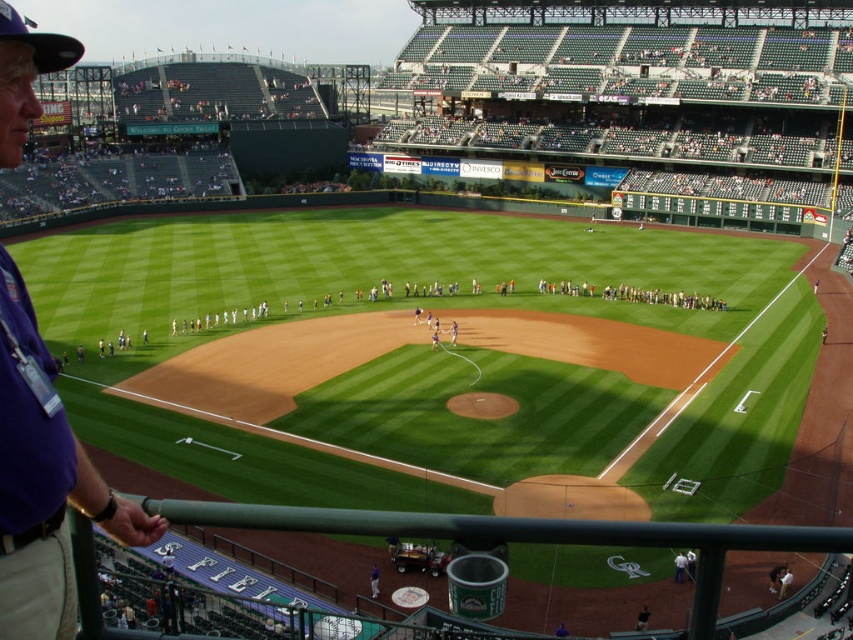
Question: Can you confirm if white uniform players at center is positioned below blue uniformed man at center?

Choices:
 (A) no
 (B) yes

Answer: (A)

Question: Which object is the farthest from the blue uniformed man at center?

Choices:
 (A) purple fabric shirt at left
 (B) white uniform players at center
 (C) white shirt at lower right

Answer: (B)

Question: From the image, what is the correct spatial relationship of white uniform players at center in relation to blue uniformed man at center?

Choices:
 (A) below
 (B) above

Answer: (B)

Question: Considering the real-world distances, which object is farthest from the white uniform players at center?

Choices:
 (A) purple fabric shirt at left
 (B) white shirt at lower right
 (C) blue uniformed man at center

Answer: (A)

Question: Which object is farther from the camera taking this photo?

Choices:
 (A) blue uniformed man at center
 (B) white shirt at lower right
 (C) purple fabric shirt at left
 (D) white uniform players at center

Answer: (D)

Question: Is purple fabric shirt at left smaller than white shirt at lower right?

Choices:
 (A) yes
 (B) no

Answer: (B)